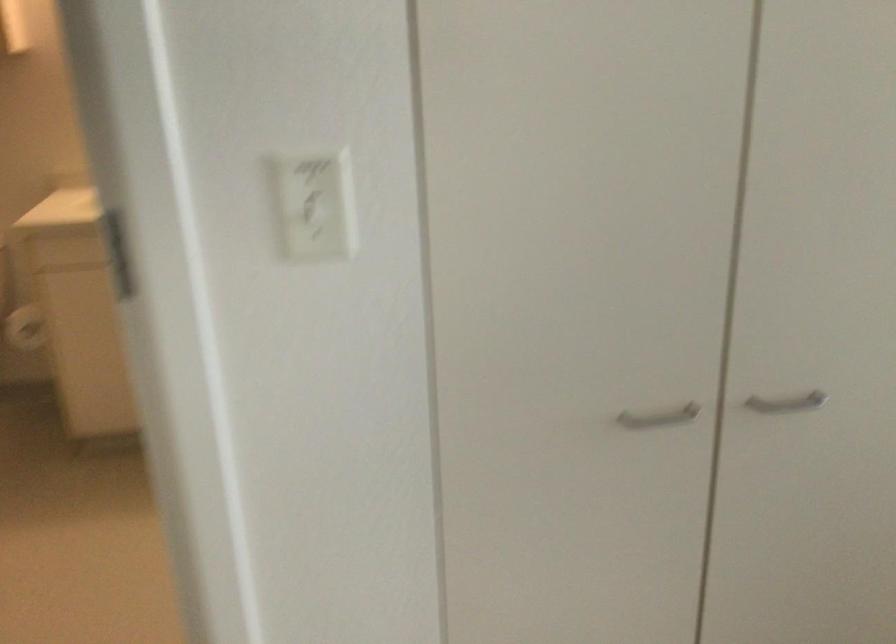
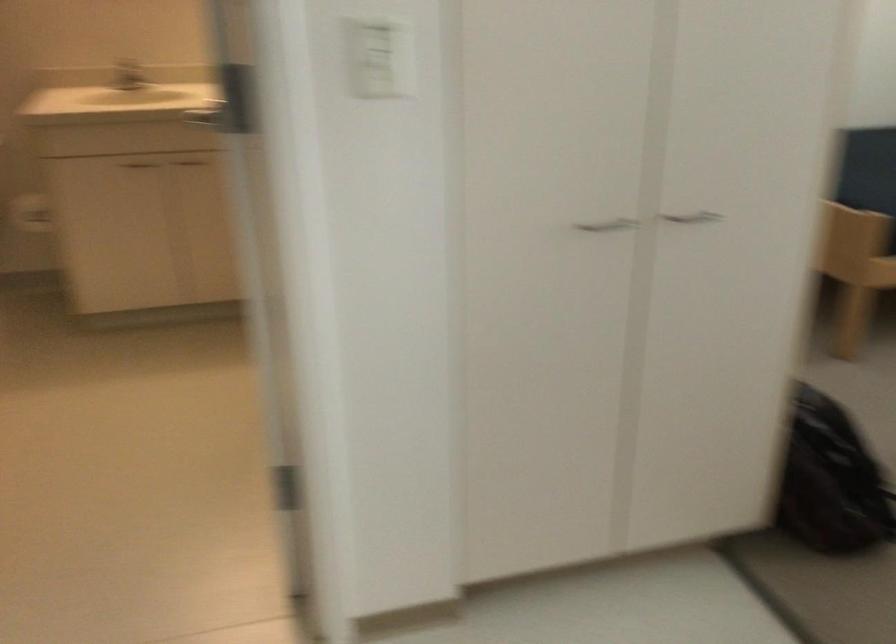
Find the pixel in the second image that matches point 672,412 in the first image.

(607, 225)